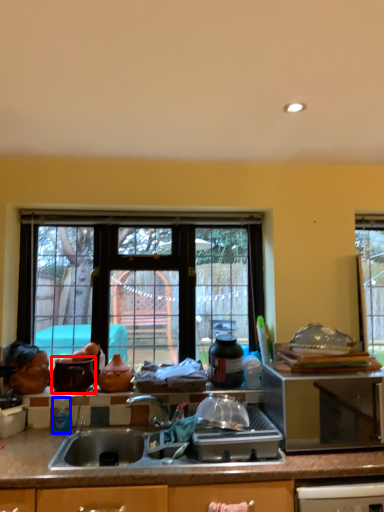
Question: Which of the following is the farthest to the observer, appliance (highlighted by a red box) or bottle (highlighted by a blue box)?

Choices:
 (A) appliance
 (B) bottle

Answer: (A)